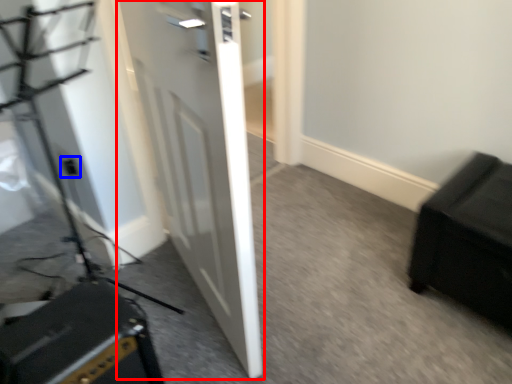
Question: Which of the following is the closest to the observer, door (highlighted by a red box) or electric outlet (highlighted by a blue box)?

Choices:
 (A) door
 (B) electric outlet

Answer: (A)